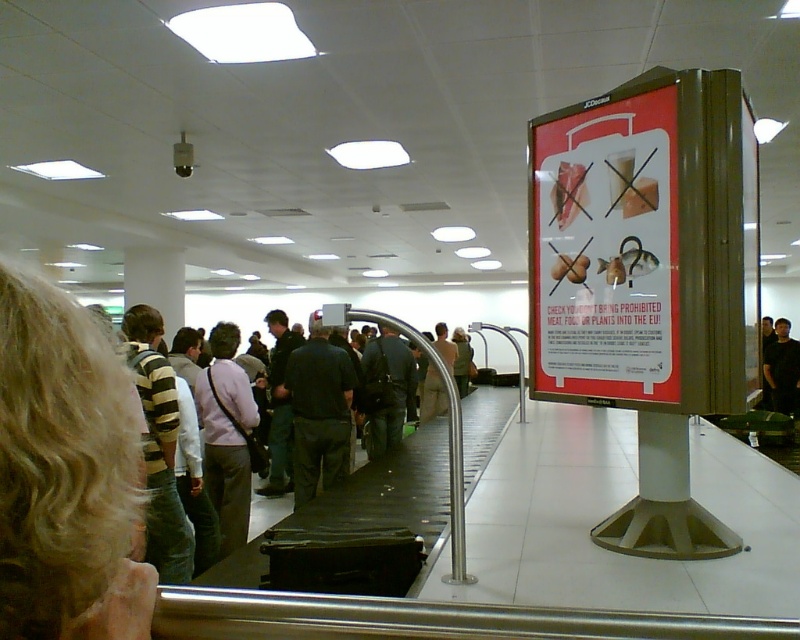
Question: Considering the relative positions of dark gray pants at center and dark blue jeans at center in the image provided, where is dark gray pants at center located with respect to dark blue jeans at center?

Choices:
 (A) left
 (B) right

Answer: (A)

Question: Can you confirm if light purple fabric shirt at center is positioned to the left of dark gray pants at center?

Choices:
 (A) yes
 (B) no

Answer: (A)

Question: Which object is positioned closest to the light purple fabric shirt at center?

Choices:
 (A) matte plastic sign at upper right
 (B) light brown fabric jacket at center

Answer: (A)

Question: Can you confirm if matte plastic sign at upper right is positioned below dark blue jeans at center?

Choices:
 (A) no
 (B) yes

Answer: (A)

Question: Which point appears closest to the camera in this image?

Choices:
 (A) (421, 400)
 (B) (222, 484)
 (C) (108, 440)

Answer: (C)

Question: Estimate the real-world distances between objects in this image. Which object is farther from the light brown fabric jacket at center?

Choices:
 (A) light purple fabric shirt at center
 (B) dark blue jeans at center

Answer: (A)